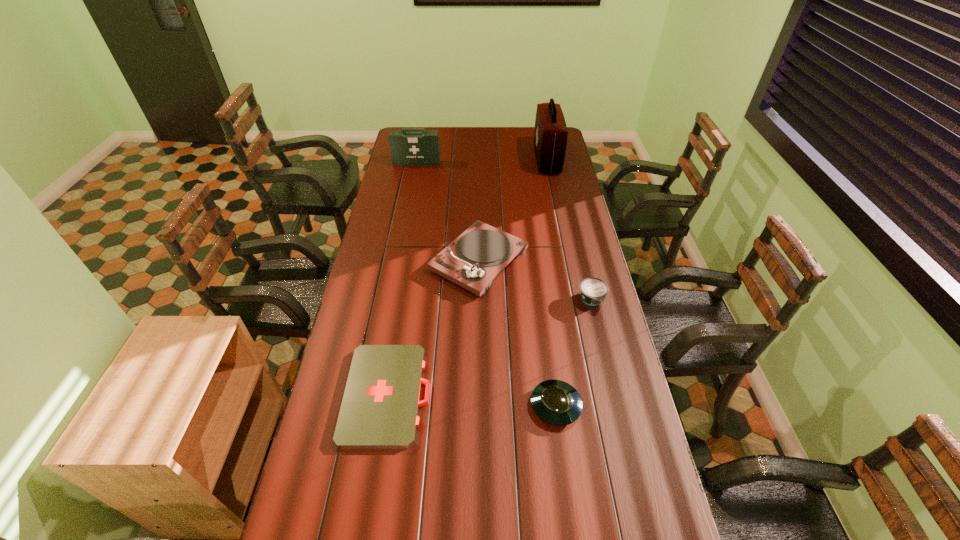
Find the location of a particular element. The width and height of the screenshot is (960, 540). vacant point located between the third tallest object and the saucer is located at coordinates (517, 333).

I want to click on free spot between the yogurt and the saucer, so click(574, 353).

Point out which object is positioned as the fifth nearest to the yogurt. Please provide its 2D coordinates. Your answer should be formatted as a tuple, i.e. [(x, y)], where the tuple contains the x and y coordinates of a point satisfying the conditions above.

[(410, 146)]

Select which object is the fifth closest to the second tallest object. Please provide its 2D coordinates. Your answer should be formatted as a tuple, i.e. [(x, y)], where the tuple contains the x and y coordinates of a point satisfying the conditions above.

[(555, 402)]

Select which first-aid kit appears as the third closest to the saucer. Please provide its 2D coordinates. Your answer should be formatted as a tuple, i.e. [(x, y)], where the tuple contains the x and y coordinates of a point satisfying the conditions above.

[(410, 146)]

You are a GUI agent. You are given a task and a screenshot of the screen. Output one action in this format:
    pyautogui.click(x=<x>, y=<y>)
    Task: Click on the first-aid kit that is the closest to the shortest first-aid kit
    This screenshot has height=540, width=960.
    Given the screenshot: What is the action you would take?
    pyautogui.click(x=550, y=136)

Identify the location of vacant area in the image that satisfies the following two spatial constraints: 1. on the side of the yogurt with the cross symbol; 2. on the left side of the rightmost first-aid kit. (576, 301).

At what (x,y) coordinates should I click in order to perform the action: click on vacant space that satisfies the following two spatial constraints: 1. on the back side of the saucer; 2. on handle side the nearest first-aid kit. Please return your answer as a coordinate pair (x, y). This screenshot has width=960, height=540. Looking at the image, I should click on pos(554,394).

Find the location of a particular element. vacant area in the image that satisfies the following two spatial constraints: 1. on the front-facing side of the second shortest first-aid kit; 2. on the right side of the yogurt is located at coordinates (390, 301).